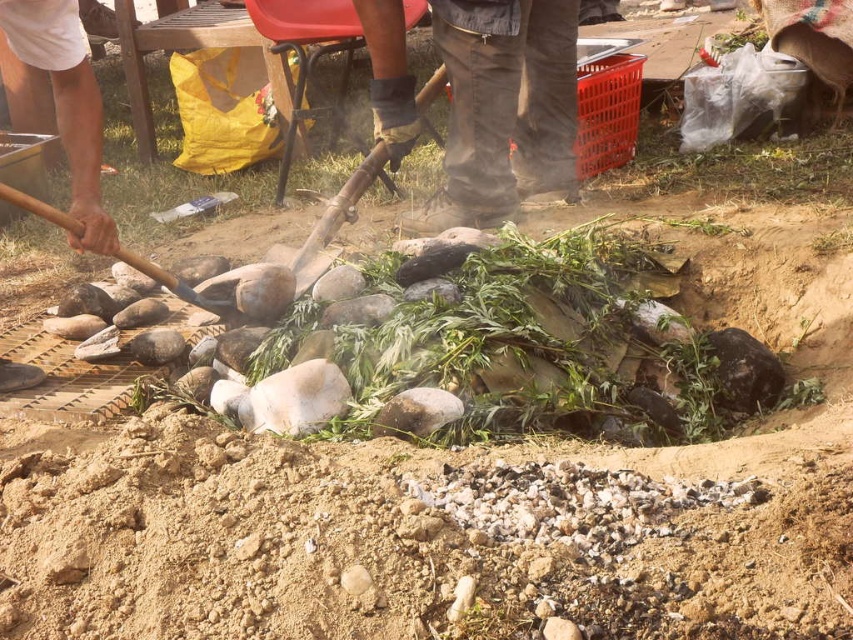
Between brown leather boots at center and brown leather glove at upper center, which one is positioned higher?

brown leather boots at center is above.

Who is positioned more to the left, brown leather boots at center or brown leather glove at upper center?

Positioned to the left is brown leather glove at upper center.

The width and height of the screenshot is (853, 640). Find the location of `brown leather boots at center`. brown leather boots at center is located at coordinates (503, 106).

Between point (508, 148) and point (49, 221), which one is positioned behind?

The point (508, 148) is more distant.

Does brown leather boots at center appear on the right side of wooden handle shovel at center?

Indeed, brown leather boots at center is positioned on the right side of wooden handle shovel at center.

The height and width of the screenshot is (640, 853). In order to click on brown leather boots at center in this screenshot , I will do `click(503, 106)`.

Does wooden shovel at center have a greater height compared to wooden handle shovel at center?

Yes, wooden shovel at center is taller than wooden handle shovel at center.

Is the position of wooden shovel at center less distant than that of wooden handle shovel at center?

No, it is not.

Is point (294, 278) farther from camera compared to point (181, 289)?

Yes, it is behind point (181, 289).

Locate an element on the screen. wooden shovel at center is located at coordinates (334, 220).